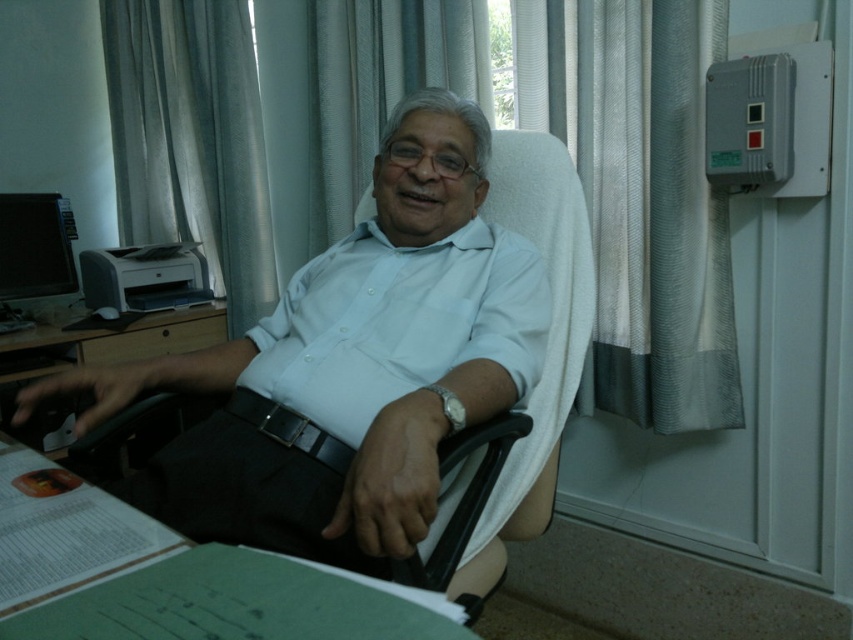
Question: Can you confirm if white cotton shirt at center is positioned to the left of gray fabric curtain at upper left?

Choices:
 (A) no
 (B) yes

Answer: (A)

Question: Which of the following is the farthest from the observer?

Choices:
 (A) (268, 202)
 (B) (283, 326)
 (C) (573, 244)

Answer: (A)

Question: Is white textured curtain at upper center in front of white smooth shirt at center?

Choices:
 (A) yes
 (B) no

Answer: (B)

Question: Among these points, which one is farthest from the camera?

Choices:
 (A) (73, 404)
 (B) (42, 378)
 (C) (418, 317)
 (D) (492, 568)

Answer: (A)

Question: Can you confirm if white textured curtain at upper center is smaller than gray fabric curtain at upper left?

Choices:
 (A) yes
 (B) no

Answer: (B)

Question: Among these objects, which one is nearest to the camera?

Choices:
 (A) black plastic swivel chair at center
 (B) white smooth shirt at center
 (C) white cotton shirt at center

Answer: (C)